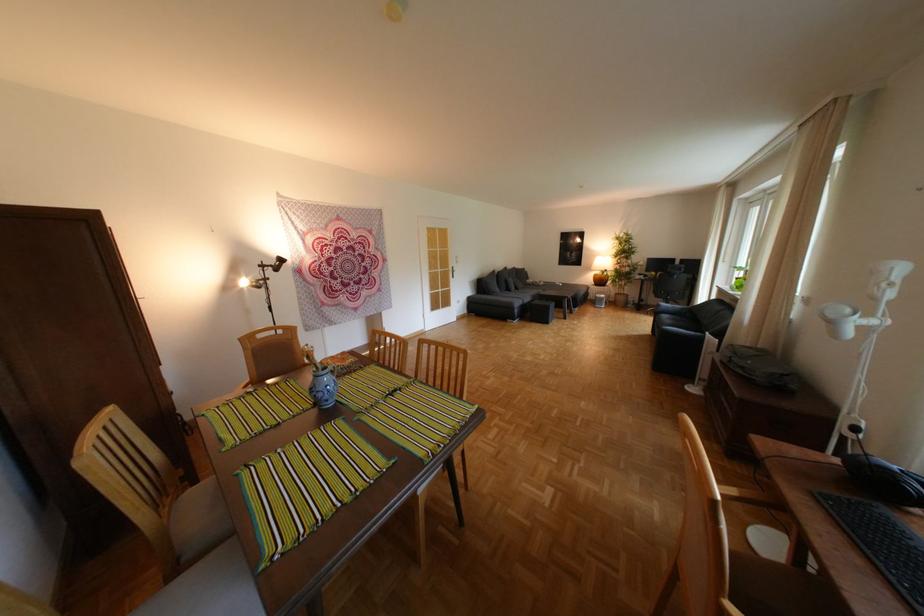
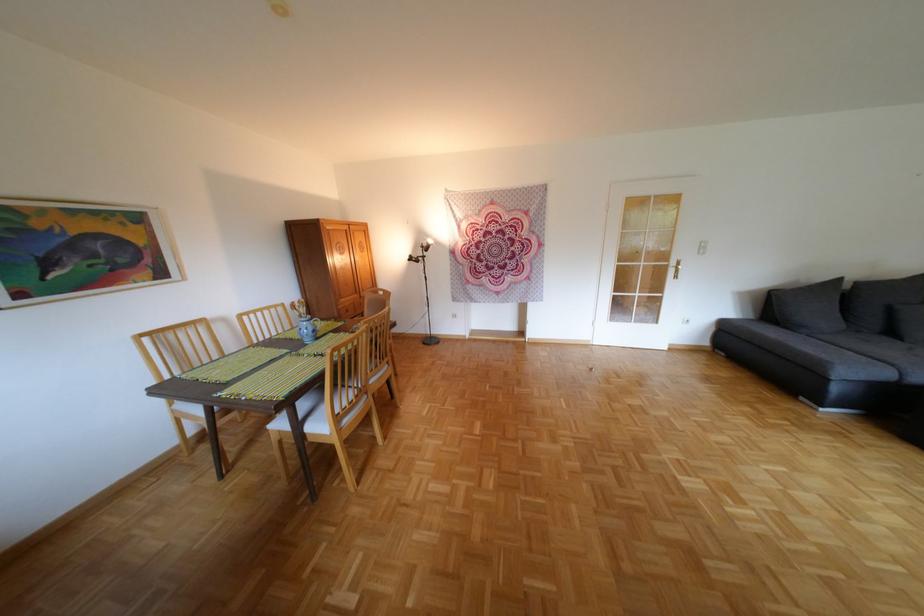
Find the pixel in the second image that matches point 493,285 in the first image.

(787, 304)